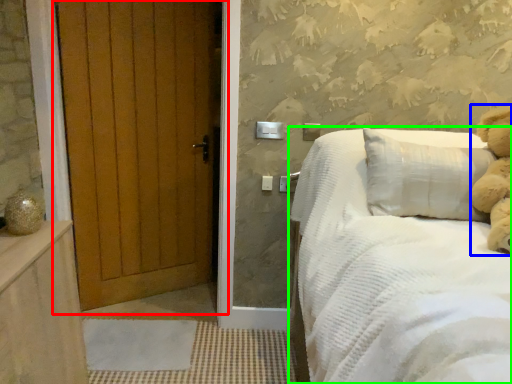
Question: Estimate the real-world distances between objects in this image. Which object is farther from door (highlighted by a red box), teddy (highlighted by a blue box) or bed (highlighted by a green box)?

Choices:
 (A) teddy
 (B) bed

Answer: (A)